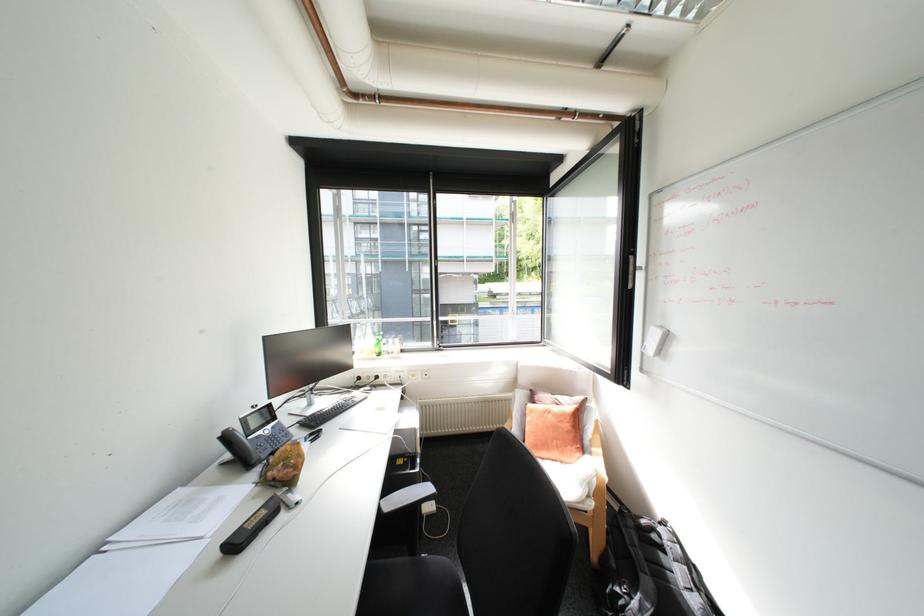
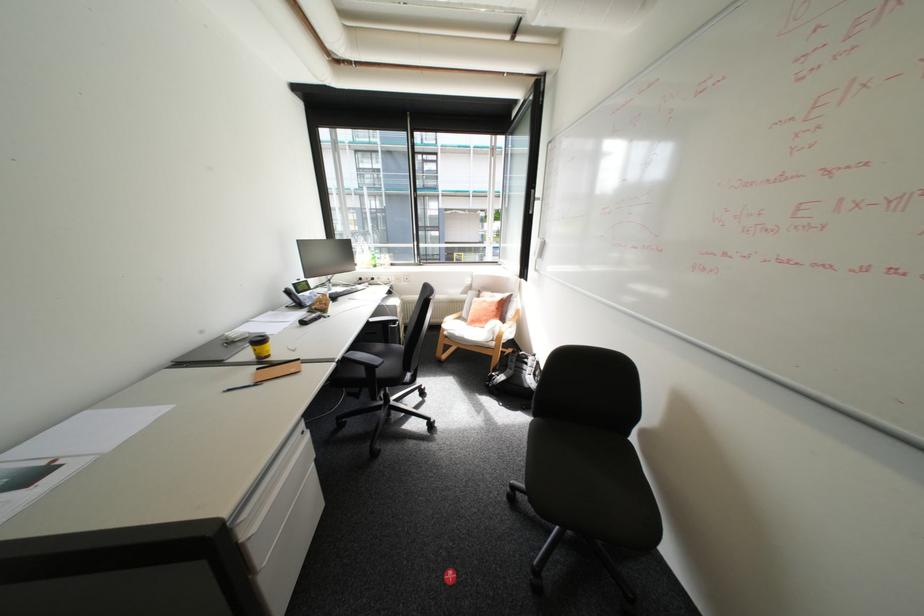
Question: The first image is from the beginning of the video and the second image is from the end. How did the camera likely rotate when shooting the video?

Choices:
 (A) Left
 (B) Right
 (C) Up
 (D) Down

Answer: (D)